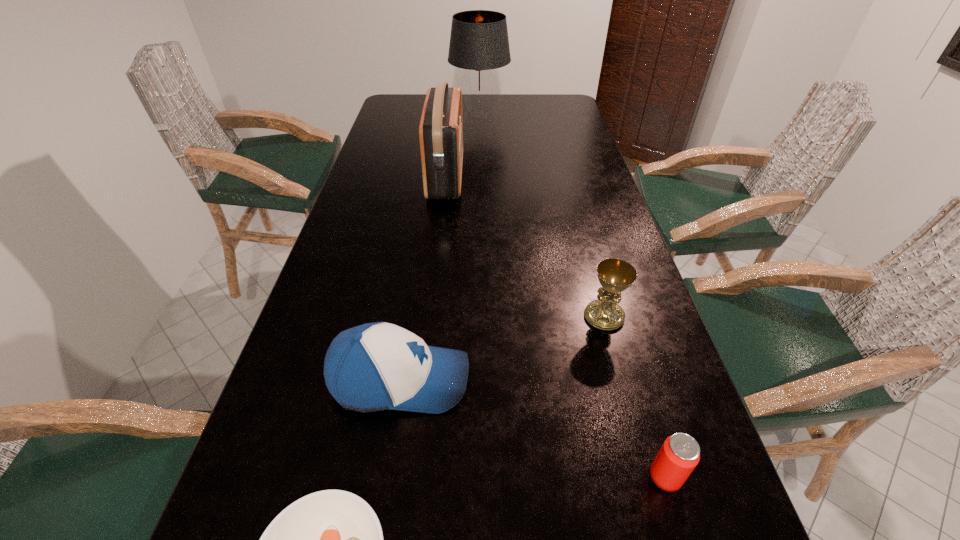
The image size is (960, 540). I want to click on free space that satisfies the following two spatial constraints: 1. on the front-facing side of the second tallest object; 2. on the back side of the second shortest object, so click(x=413, y=477).

Image resolution: width=960 pixels, height=540 pixels. In order to click on vacant position in the image that satisfies the following two spatial constraints: 1. on the front-facing side of the fifth shortest object; 2. on the back side of the third farthest object in this screenshot , I will do `click(431, 316)`.

Where is `vacant space that satisfies the following two spatial constraints: 1. on the front-facing side of the radio receiver; 2. on the right side of the second shortest object`? The image size is (960, 540). vacant space that satisfies the following two spatial constraints: 1. on the front-facing side of the radio receiver; 2. on the right side of the second shortest object is located at coordinates (413, 477).